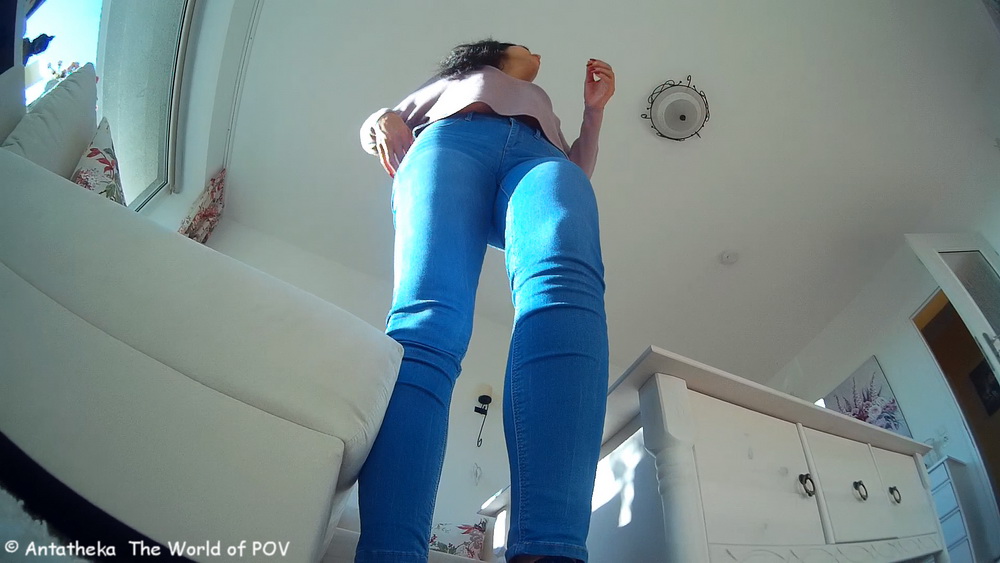
The image size is (1000, 563). In order to click on curtain in this screenshot , I will do `click(208, 205)`.